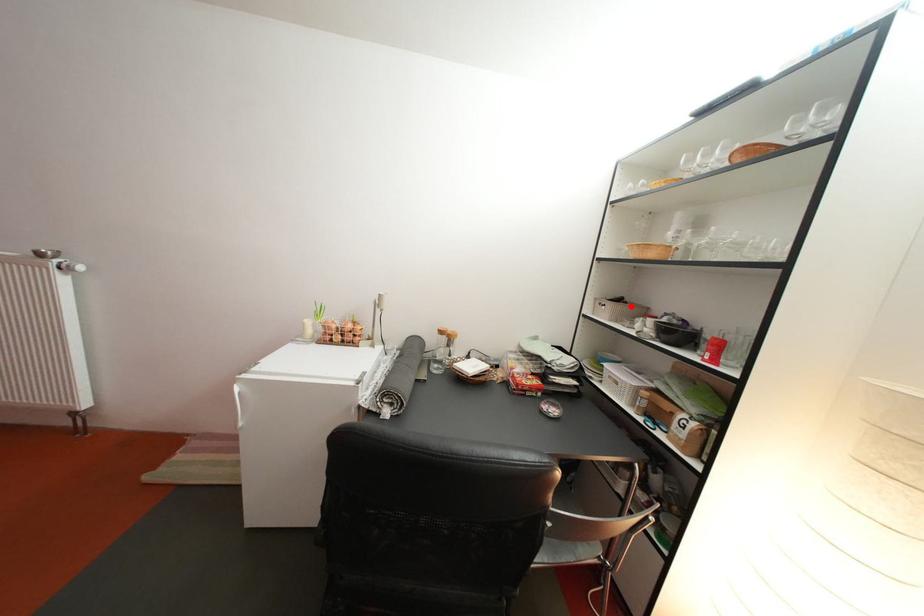
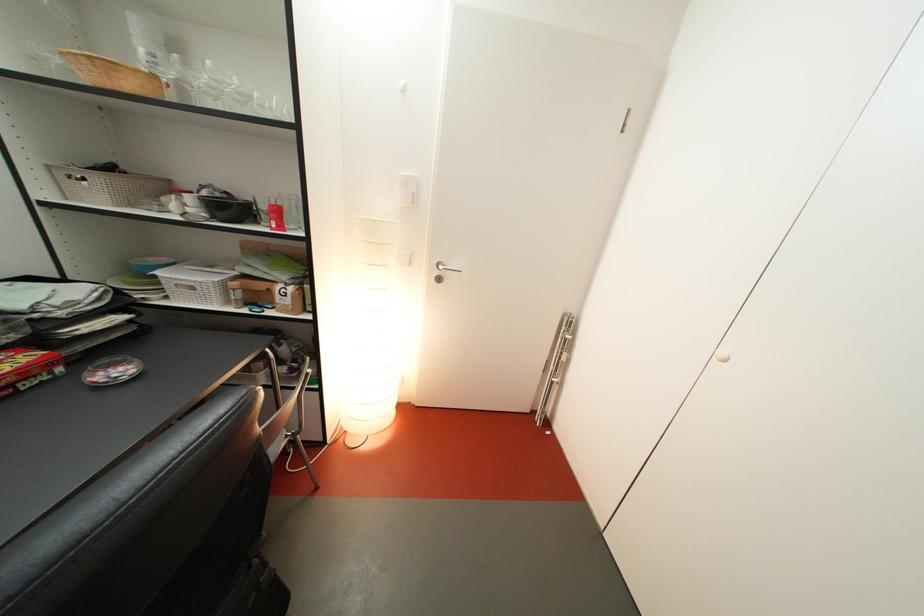
The point at the highlighted location is marked in the first image. Where is the corresponding point in the second image?

(122, 175)